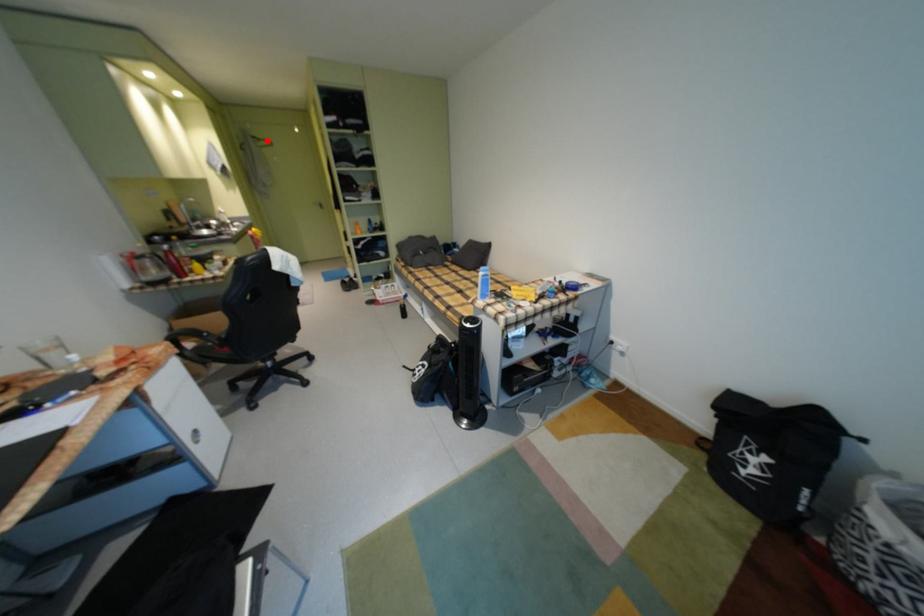
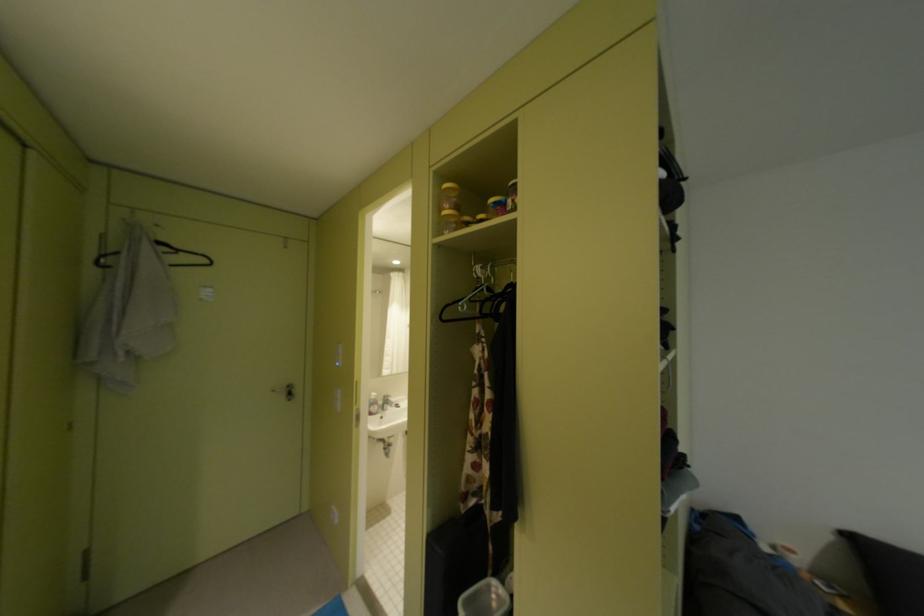
Locate, in the second image, the point that corresponds to the highlighted location in the first image.

(175, 249)